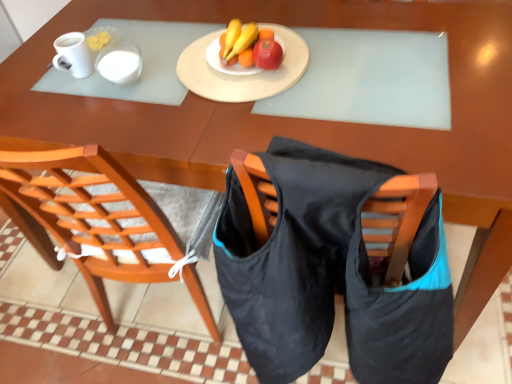
Question: From a real-world perspective, is matte white plate at center located higher than wooden chair at center?

Choices:
 (A) yes
 (B) no

Answer: (A)

Question: Is matte white plate at center not close to wooden chair at center?

Choices:
 (A) no
 (B) yes

Answer: (A)

Question: Considering the relative positions of matte white plate at center and wooden chair at center in the image provided, is matte white plate at center to the right of wooden chair at center from the viewer's perspective?

Choices:
 (A) no
 (B) yes

Answer: (B)

Question: Does matte white plate at center have a lesser width compared to wooden chair at center?

Choices:
 (A) yes
 (B) no

Answer: (A)

Question: Is matte white plate at center next to wooden chair at center and touching it?

Choices:
 (A) no
 (B) yes

Answer: (A)

Question: Is matte white plate at center surrounding wooden chair at center?

Choices:
 (A) yes
 (B) no

Answer: (B)

Question: Can you confirm if wooden chair at center is smaller than matte red apple at center?

Choices:
 (A) yes
 (B) no

Answer: (B)

Question: Could you tell me if wooden chair at center is turned towards matte red apple at center?

Choices:
 (A) yes
 (B) no

Answer: (B)

Question: Can we say wooden chair at center lies outside matte red apple at center?

Choices:
 (A) no
 (B) yes

Answer: (B)

Question: Considering the relative positions of wooden chair at center and matte red apple at center in the image provided, is wooden chair at center to the right of matte red apple at center from the viewer's perspective?

Choices:
 (A) no
 (B) yes

Answer: (A)

Question: Is wooden chair at center wider than matte red apple at center?

Choices:
 (A) no
 (B) yes

Answer: (B)

Question: Is wooden chair at center to the left of matte red apple at center from the viewer's perspective?

Choices:
 (A) yes
 (B) no

Answer: (A)

Question: Is matte yellow banana at center far away from white glossy mug at upper left?

Choices:
 (A) yes
 (B) no

Answer: (B)